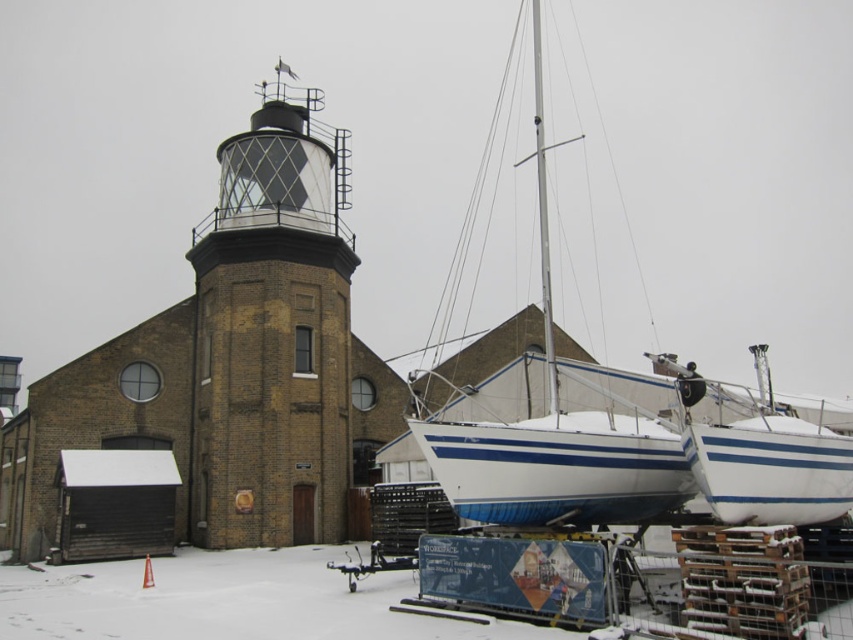
What do you see at coordinates (556, 436) in the screenshot?
I see `white glossy sailboat at center` at bounding box center [556, 436].

Which is below, white glossy sailboat at center or white glossy mast at center?

Positioned lower is white glossy sailboat at center.

Is point (476, 465) positioned after point (548, 259)?

No.

At what (x,y) coordinates should I click in order to perform the action: click on white glossy sailboat at center. Please return your answer as a coordinate pair (x, y). The image size is (853, 640). Looking at the image, I should click on (556, 436).

Is matte black lighthouse at center thinner than white glossy sailboat at center?

Yes, matte black lighthouse at center is thinner than white glossy sailboat at center.

Can you confirm if matte black lighthouse at center is positioned below white glossy sailboat at center?

Yes.

Is point (241, 540) farther from viewer compared to point (448, 436)?

That is True.

The height and width of the screenshot is (640, 853). What are the coordinates of `matte black lighthouse at center` in the screenshot? It's located at (271, 333).

Does matte black lighthouse at center have a smaller size compared to white glossy mast at center?

Indeed, matte black lighthouse at center has a smaller size compared to white glossy mast at center.

Can you confirm if matte black lighthouse at center is thinner than white glossy mast at center?

Indeed, matte black lighthouse at center has a lesser width compared to white glossy mast at center.

This screenshot has height=640, width=853. I want to click on matte black lighthouse at center, so click(271, 333).